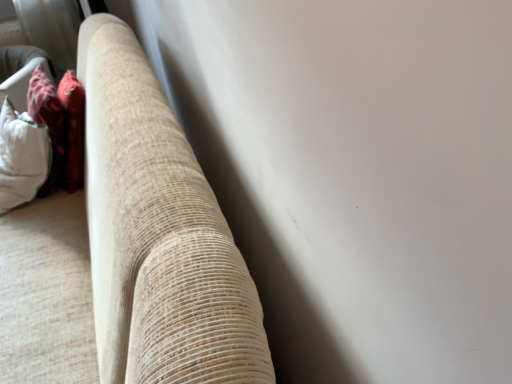
You are a GUI agent. You are given a task and a screenshot of the screen. Output one action in this format:
    pyautogui.click(x=<x>, y=<y>)
    Task: Click on the beige corduroy couch at left
    The width and height of the screenshot is (512, 384).
    Given the screenshot: What is the action you would take?
    pyautogui.click(x=142, y=246)

What do you see at coordinates (142, 246) in the screenshot? I see `beige corduroy couch at left` at bounding box center [142, 246].

This screenshot has width=512, height=384. I want to click on beige corduroy couch at left, so click(142, 246).